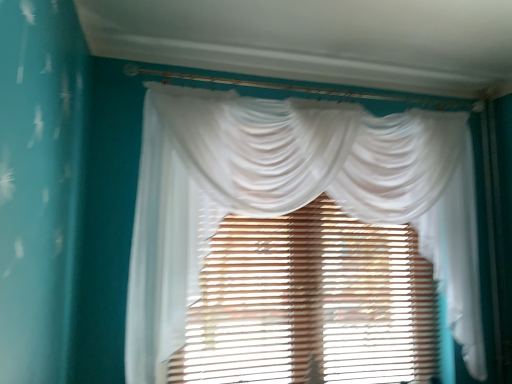
Question: Is point (379, 190) closer or farther from the camera than point (423, 319)?

Choices:
 (A) closer
 (B) farther

Answer: (A)

Question: In the image, is white sheer curtain at center positioned in front of or behind translucent wood blinds at center?

Choices:
 (A) front
 (B) behind

Answer: (A)

Question: In terms of size, does white sheer curtain at center appear bigger or smaller than translucent wood blinds at center?

Choices:
 (A) big
 (B) small

Answer: (A)

Question: Does point (331, 372) appear closer or farther from the camera than point (460, 205)?

Choices:
 (A) farther
 (B) closer

Answer: (B)

Question: From a real-world perspective, is translucent wood blinds at center positioned above or below white sheer curtain at center?

Choices:
 (A) below
 (B) above

Answer: (A)

Question: Would you say translucent wood blinds at center is inside or outside white sheer curtain at center?

Choices:
 (A) inside
 (B) outside

Answer: (B)

Question: From the image's perspective, relative to white sheer curtain at center, is translucent wood blinds at center above or below?

Choices:
 (A) below
 (B) above

Answer: (A)